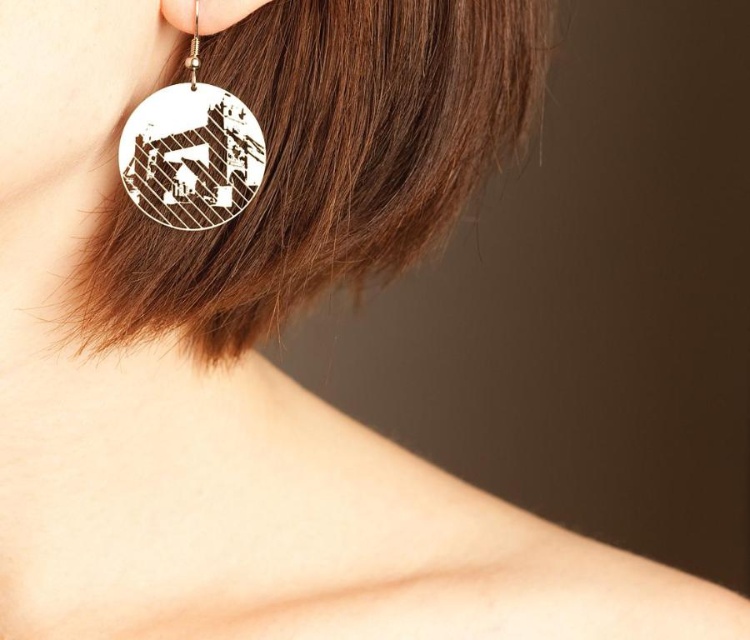
You are a stylist trying to place a new accessory on the left side of the person. You have a small silver pendant that is 2 cm wide. Considering the brown matte hair at upper left and the white wood circle at left, which object has a wider width to accommodate the pendant?

The brown matte hair at upper left has a larger width than the white wood circle at left, so the pendant can be placed there as it has enough space.

You are an artist trying to sketch the earring arrangement. You see the white wood circle at left and the silver metallic earring at upper left. Which object is placed lower in the image?

The white wood circle at left is positioned under the silver metallic earring at upper left, so it is placed lower in the image.

You are a photographer adjusting the lighting to highlight the silver metallic earring at upper left and the brown matte hair at upper left. Which object should you focus on first if you want to ensure both are well lit, considering their positions?

The silver metallic earring at upper left should be focused on first because the brown matte hair at upper left is positioned under it, so adjusting the light for the earring will also illuminate the hair beneath.